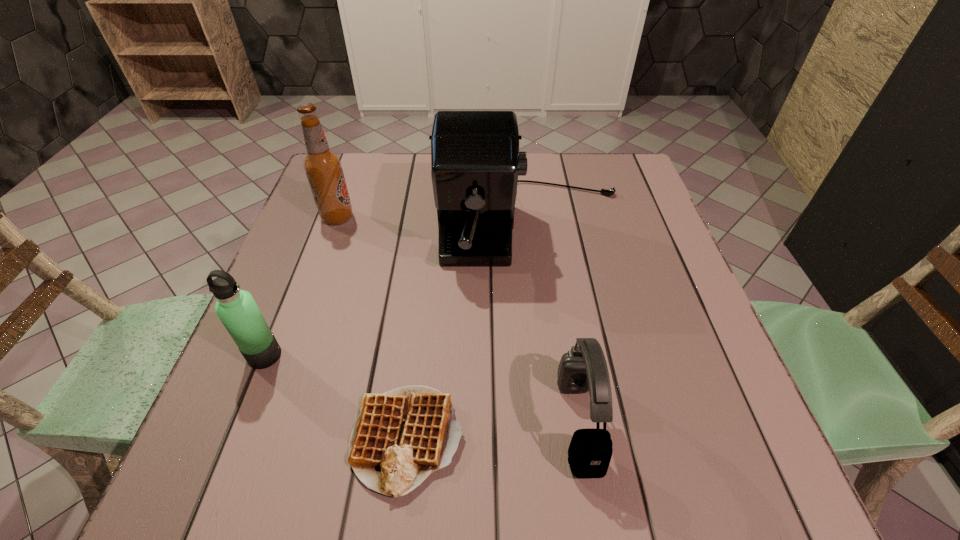
Locate an element on the screen. This screenshot has width=960, height=540. beer bottle is located at coordinates (323, 167).

Identify the location of coffee maker. (475, 161).

At what (x,y) coordinates should I click in order to perform the action: click on the third shortest object. Please return your answer as a coordinate pair (x, y). The height and width of the screenshot is (540, 960). Looking at the image, I should click on (237, 310).

This screenshot has height=540, width=960. Find the location of `the third farthest object`. the third farthest object is located at coordinates (237, 310).

This screenshot has width=960, height=540. I want to click on headset, so click(x=583, y=368).

Locate an element on the screen. The height and width of the screenshot is (540, 960). the shortest object is located at coordinates (400, 437).

Identify the location of free space located on the front label of the beer bottle. The height and width of the screenshot is (540, 960). (474, 218).

I want to click on vacant position located 0.400m on the front-facing side of the coffee maker, so click(x=564, y=477).

The height and width of the screenshot is (540, 960). I want to click on free point located 0.060m on the back of the thermos bottle, so click(279, 318).

This screenshot has width=960, height=540. I want to click on blank space located 0.290m on the headband of the headset, so click(391, 422).